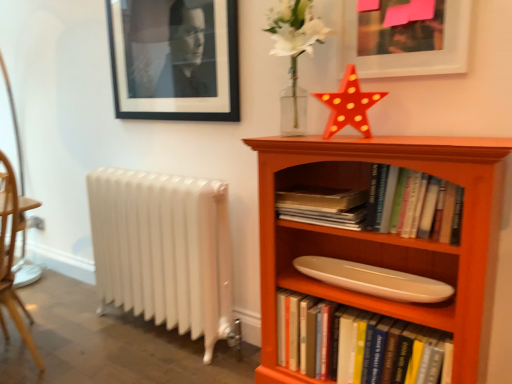
Question: Considering the relative positions of orange wood bookcase at right and white glossy bookshelf at center, the 2th book from the top, in the image provided, is orange wood bookcase at right to the left or to the right of white glossy bookshelf at center, the 2th book from the top,?

Choices:
 (A) left
 (B) right

Answer: (A)

Question: Is point (470, 168) positioned closer to the camera than point (426, 342)?

Choices:
 (A) farther
 (B) closer

Answer: (B)

Question: Which of these objects is positioned farthest from the white metallic radiator at lower left?

Choices:
 (A) shiny plastic star at upper center
 (B) black matte picture frame at upper left, which ranks as the 1th picture frame in back-to-front order
 (C) white glossy bookshelf at center, the 2th book from the top
 (D) hardcover book at center, positioned as the first book in top-to-bottom order
 (E) matte white picture frame at upper right, which is the 2th picture frame in back-to-front order

Answer: (E)

Question: Estimate the real-world distances between objects in this image. Which object is farther from the wooden chair at left?

Choices:
 (A) shiny plastic star at upper center
 (B) orange wood bookcase at right
 (C) white glossy surfboard at center
 (D) matte white picture frame at upper right, positioned as the first picture frame in front-to-back order
 (E) black matte picture frame at upper left, arranged as the 1th picture frame when viewed from the left

Answer: (D)